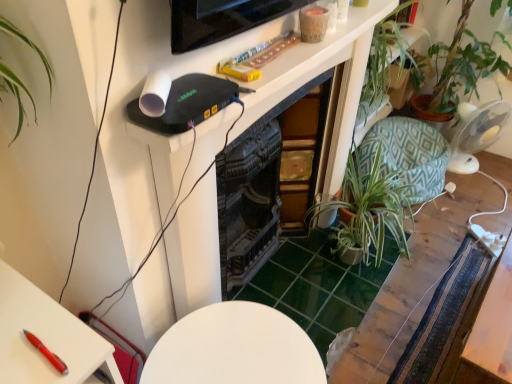
Question: Considering their positions, is transparent plastic fan at right located in front of or behind wooden table at center, which is counted as the first table, starting from the back?

Choices:
 (A) behind
 (B) front

Answer: (A)

Question: Visually, is transparent plastic fan at right positioned to the left or to the right of wooden table at center, which is counted as the first table, starting from the back?

Choices:
 (A) right
 (B) left

Answer: (A)

Question: Considering the real-world distances, which object is closest to the green leafy plant at center-right?

Choices:
 (A) teal geometric fabric swivel chair at right
 (B) green leafy plant at right
 (C) white glossy table at center, marked as the 1th table in a front-to-back arrangement
 (D) wooden table at center, which ranks as the 3th table in front-to-back order
 (E) wooden table at lower right, the 2th table when ordered from front to back

Answer: (D)

Question: Which of these objects is positioned farthest from the transparent plastic fan at right?

Choices:
 (A) green leafy plant at right
 (B) wooden table at lower right, the 2th table when ordered from front to back
 (C) wooden table at center, which ranks as the 3th table in front-to-back order
 (D) teal geometric fabric swivel chair at right
 (E) white glossy table at center, marked as the 1th table in a front-to-back arrangement

Answer: (E)